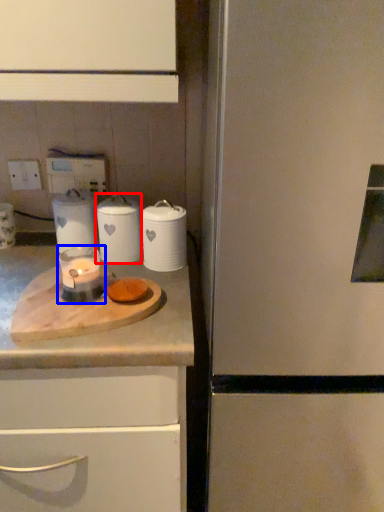
Question: Which object appears farthest to the camera in this image, kitchen appliance (highlighted by a red box) or candle holder (highlighted by a blue box)?

Choices:
 (A) kitchen appliance
 (B) candle holder

Answer: (A)